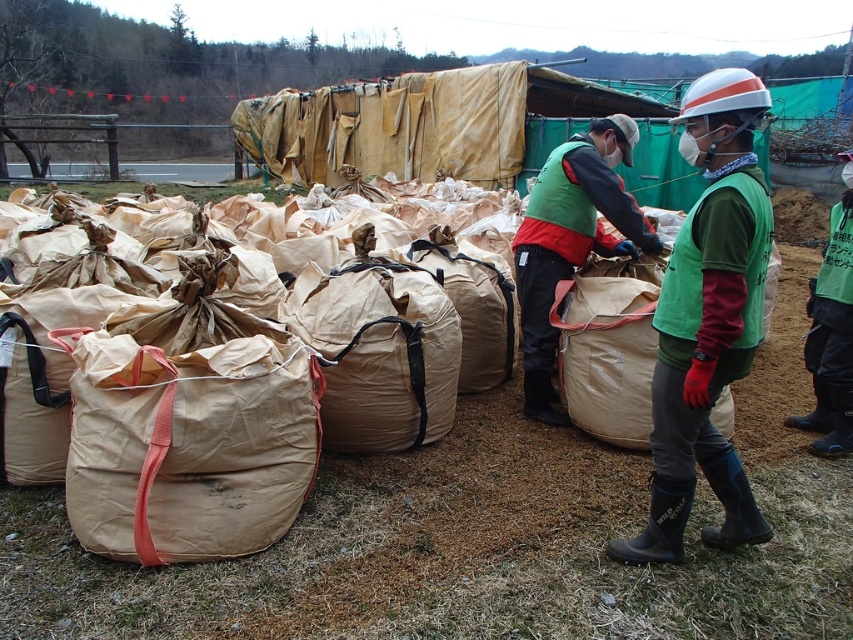
Question: In this image, where is brown paper bag at center located relative to brown paper sack at center?

Choices:
 (A) above
 (B) below

Answer: (A)

Question: Which of the following is the farthest from the observer?

Choices:
 (A) beige paper sack at center
 (B) brown paper bag at center
 (C) green fabric vest at center
 (D) brown paper sack at center

Answer: (D)

Question: Which object appears farthest from the camera in this image?

Choices:
 (A) brown paper bag at center
 (B) beige paper sack at center

Answer: (B)

Question: Which object is farther from the camera taking this photo?

Choices:
 (A) brown paper sack at center
 (B) beige paper sack at center
 (C) brown paper bag at center
 (D) green fabric vest at center

Answer: (A)

Question: Is beige paper sack at center further to the viewer compared to brown paper sack at center?

Choices:
 (A) yes
 (B) no

Answer: (B)

Question: Considering the relative positions of green fabric vest at center and beige paper sack at center in the image provided, where is green fabric vest at center located with respect to beige paper sack at center?

Choices:
 (A) right
 (B) left

Answer: (A)